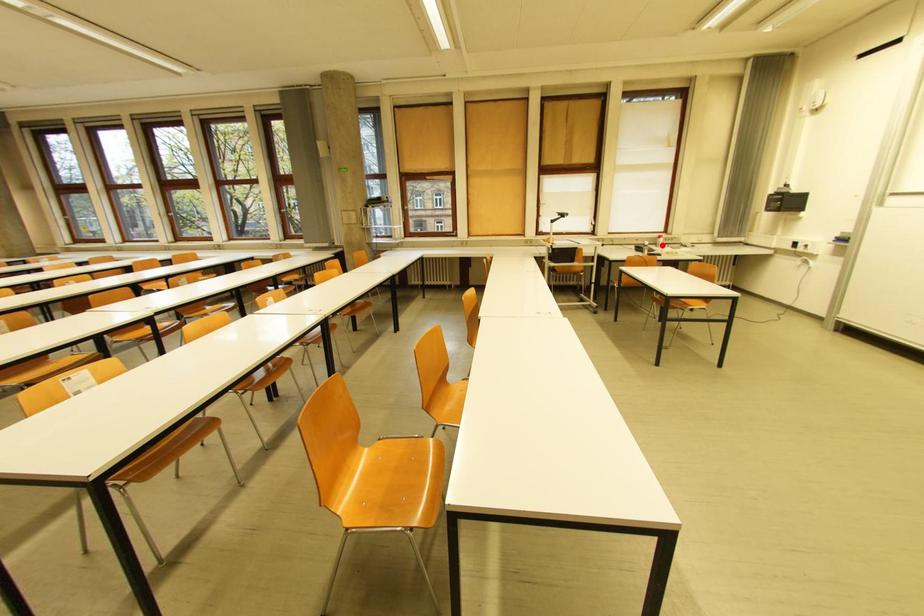
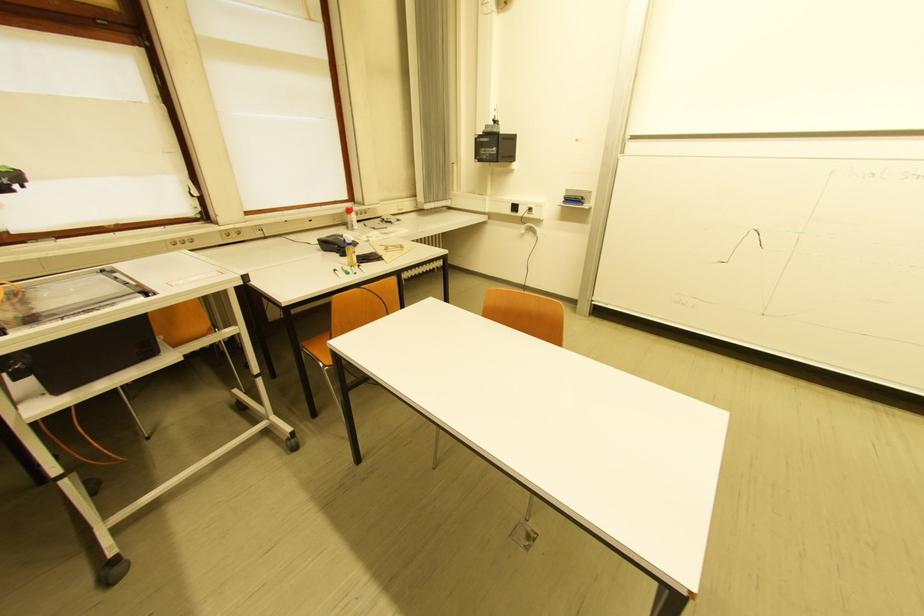
Question: I am providing you with two images of the same scene from different viewpoints. A red point is marked on the first image. Is the red point's position out of view in image 2?

Choices:
 (A) Yes
 (B) No

Answer: (B)